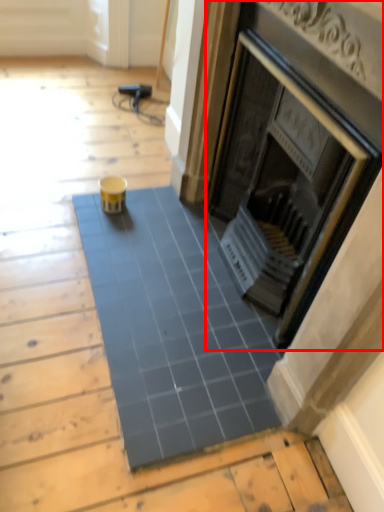
Question: Considering the relative positions of fireplace (annotated by the red box) and ceramic tile in the image provided, where is fireplace (annotated by the red box) located with respect to the staircase?

Choices:
 (A) left
 (B) right

Answer: (B)